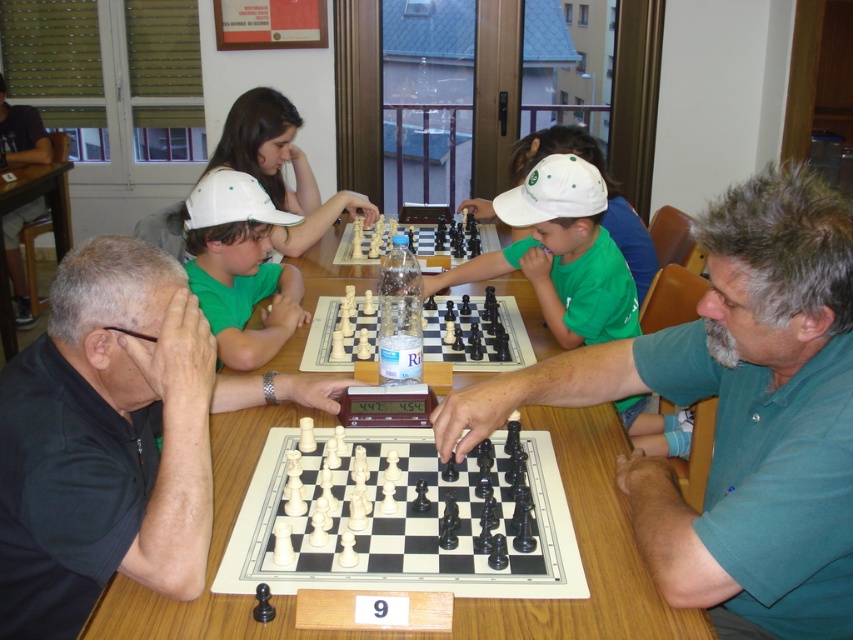
Question: Estimate the real-world distances between objects in this image. Which object is farther from the white plastic chess set at center?

Choices:
 (A) matte black chess piece at center
 (B) matte black chess set at center

Answer: (A)

Question: Is matte black chess piece at center to the right of white plastic chess set at center from the viewer's perspective?

Choices:
 (A) yes
 (B) no

Answer: (B)

Question: Considering the relative positions of white matte cap at center and wooden chessboard at center in the image provided, where is white matte cap at center located with respect to wooden chessboard at center?

Choices:
 (A) above
 (B) below

Answer: (A)

Question: Which point is farther to the camera?

Choices:
 (A) matte black chess set at center
 (B) matte green cap at center
 (C) wooden chessboard at center

Answer: (C)

Question: Among these objects, which one is nearest to the camera?

Choices:
 (A) white matte cap at center
 (B) white plastic chess set at center
 (C) white plastic chess pieces at center
 (D) white plastic chessboard at center

Answer: (D)

Question: Is wooden chessboard at center wider than white plastic chess set at center?

Choices:
 (A) yes
 (B) no

Answer: (A)